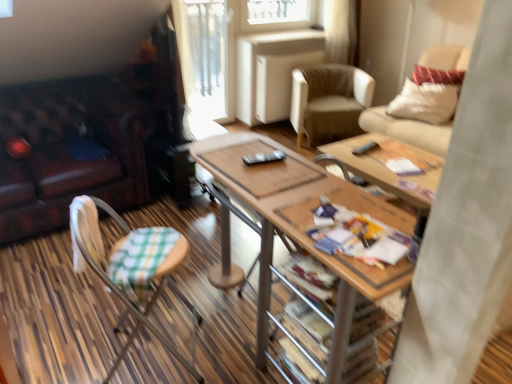
This screenshot has height=384, width=512. Find the location of `free space to the back side of printed paper magazine at center`. free space to the back side of printed paper magazine at center is located at coordinates 342,207.